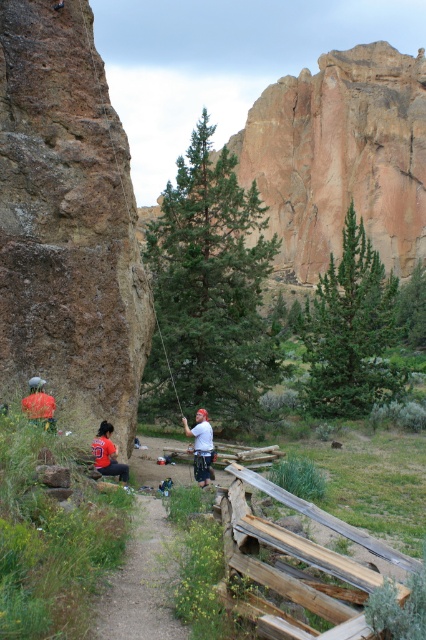
Who is more distant from viewer, (316, 412) or (54, 428)?

The point (316, 412) is more distant.

Who is shorter, green needle-like pine at center or red fabric person at lower left?

red fabric person at lower left is shorter.

In order to click on green needle-like pine at center in this screenshot , I will do `click(351, 332)`.

Is brown rough rock at left to the right of green needle-like pine at center from the viewer's perspective?

In fact, brown rough rock at left is to the left of green needle-like pine at center.

Does brown rough rock at left appear under green needle-like pine at center?

Correct, brown rough rock at left is located below green needle-like pine at center.

Does point (13, 330) lie in front of point (340, 381)?

Yes, point (13, 330) is in front of point (340, 381).

Find the location of a particular element. This screenshot has width=426, height=640. brown rough rock at left is located at coordinates (68, 220).

Which is above, green textured pine tree at center or orange t-shirt at lower left?

green textured pine tree at center is higher up.

Is green textured pine tree at center bigger than orange t-shirt at lower left?

Yes, green textured pine tree at center is bigger than orange t-shirt at lower left.

The image size is (426, 640). What are the coordinates of `green textured pine tree at center` in the screenshot? It's located at (209, 291).

Locate an element on the screen. The width and height of the screenshot is (426, 640). green textured pine tree at center is located at coordinates (209, 291).